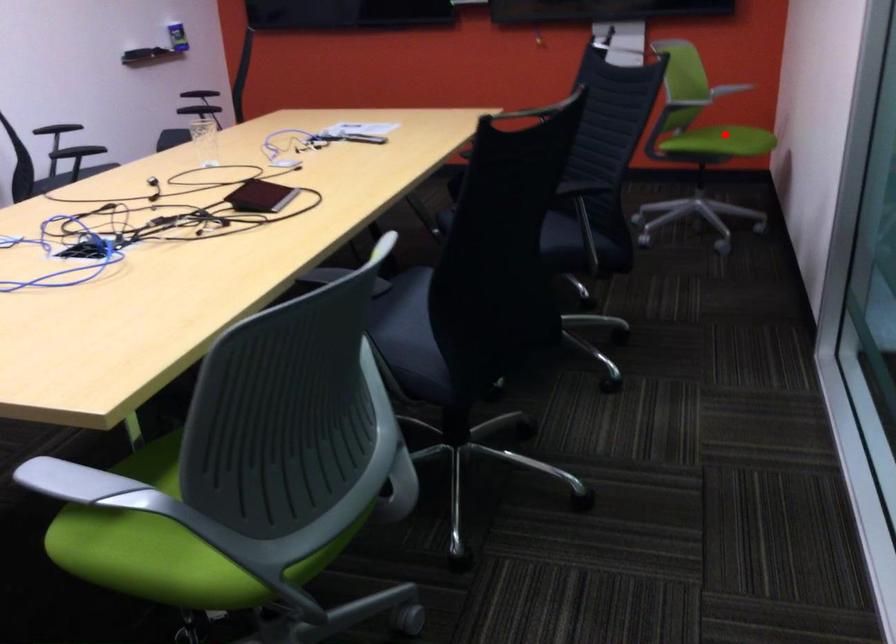
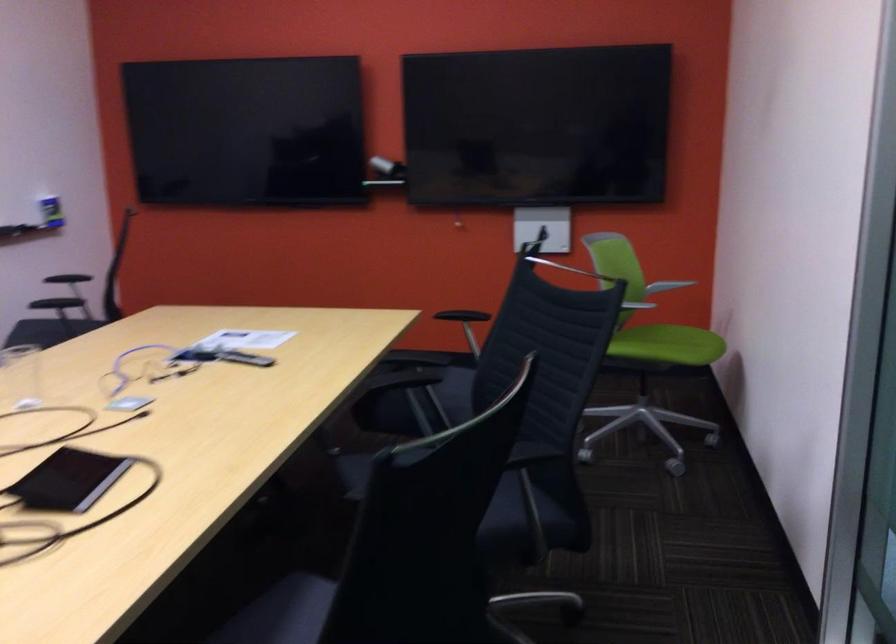
The point at the highlighted location is marked in the first image. Where is the corresponding point in the second image?

(667, 345)